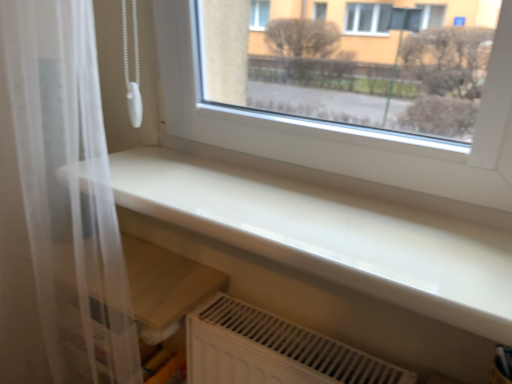
Question: From a real-world perspective, is white plastic radiator at lower center under white sheer curtain at left?

Choices:
 (A) no
 (B) yes

Answer: (B)

Question: Is white plastic radiator at lower center wider than white sheer curtain at left?

Choices:
 (A) no
 (B) yes

Answer: (A)

Question: Considering the relative positions of white plastic radiator at lower center and white sheer curtain at left in the image provided, is white plastic radiator at lower center behind white sheer curtain at left?

Choices:
 (A) yes
 (B) no

Answer: (A)

Question: From the image's perspective, is white plastic radiator at lower center beneath white sheer curtain at left?

Choices:
 (A) yes
 (B) no

Answer: (A)

Question: Is white plastic radiator at lower center to the right of white sheer curtain at left from the viewer's perspective?

Choices:
 (A) yes
 (B) no

Answer: (A)

Question: Based on their positions, is white sheer curtain at left located to the left or right of white plastic radiator at lower center?

Choices:
 (A) left
 (B) right

Answer: (A)

Question: Is white sheer curtain at left bigger or smaller than white plastic radiator at lower center?

Choices:
 (A) big
 (B) small

Answer: (A)

Question: Do you think white sheer curtain at left is within white plastic radiator at lower center, or outside of it?

Choices:
 (A) inside
 (B) outside

Answer: (B)

Question: Considering the positions of point (41, 119) and point (256, 355), is point (41, 119) closer or farther from the camera than point (256, 355)?

Choices:
 (A) farther
 (B) closer

Answer: (B)

Question: Does point (382, 374) appear closer or farther from the camera than point (23, 198)?

Choices:
 (A) closer
 (B) farther

Answer: (A)

Question: From their relative heights in the image, would you say white plastic radiator at lower center is taller or shorter than white sheer curtain at left?

Choices:
 (A) tall
 (B) short

Answer: (B)

Question: From the image's perspective, relative to white sheer curtain at left, is white plastic radiator at lower center above or below?

Choices:
 (A) above
 (B) below

Answer: (B)

Question: Is white plastic radiator at lower center to the left or to the right of white sheer curtain at left in the image?

Choices:
 (A) left
 (B) right

Answer: (B)

Question: Is point (458, 297) positioned closer to the camera than point (264, 360)?

Choices:
 (A) farther
 (B) closer

Answer: (B)

Question: From the image's perspective, is white glossy counter top at lower center positioned above or below white plastic radiator at lower center?

Choices:
 (A) above
 (B) below

Answer: (A)